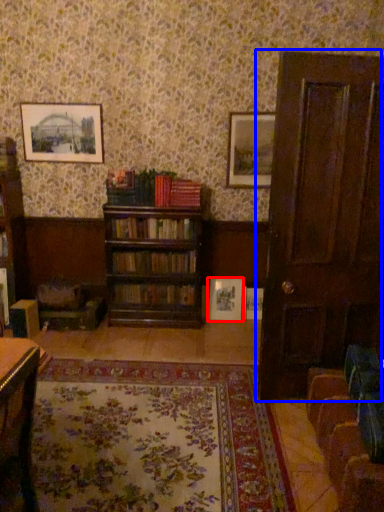
Question: Which point is closer to the camera, picture frame (highlighted by a red box) or door (highlighted by a blue box)?

Choices:
 (A) picture frame
 (B) door

Answer: (B)